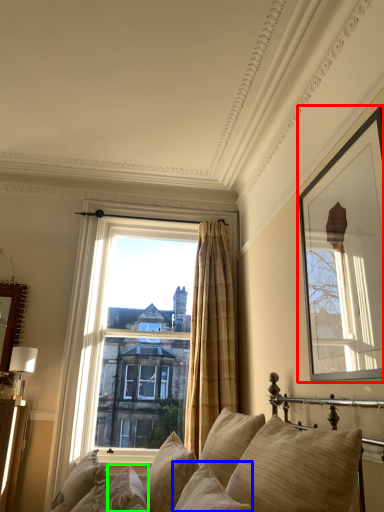
Question: Based on their relative distances, which object is farther from picture frame (highlighted by a red box)? Choose from pillow (highlighted by a blue box) and pillow (highlighted by a green box).

Choices:
 (A) pillow
 (B) pillow

Answer: (B)